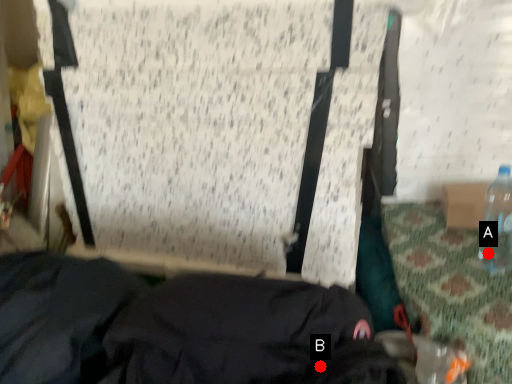
Question: Two points are circled on the image, labeled by A and B beside each circle. Which point is closer to the camera taking this photo?

Choices:
 (A) A is closer
 (B) B is closer

Answer: (B)